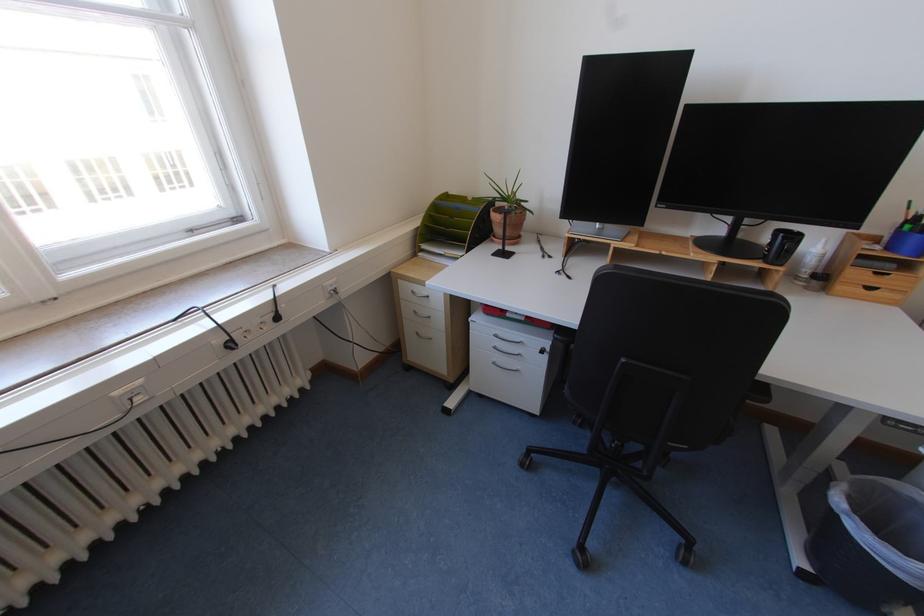
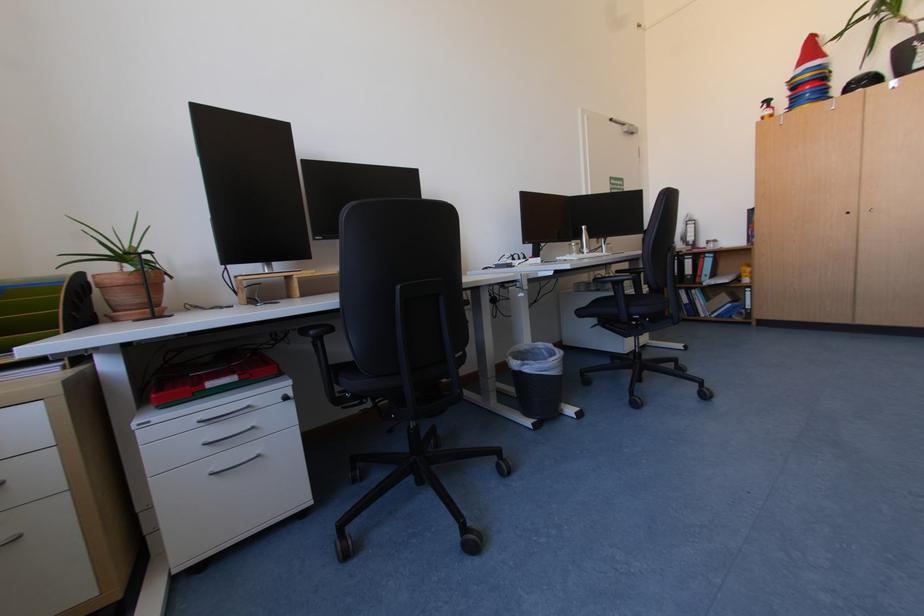
Question: The first image is from the beginning of the video and the second image is from the end. How did the camera likely rotate when shooting the video?

Choices:
 (A) Left
 (B) Right
 (C) Up
 (D) Down

Answer: (B)